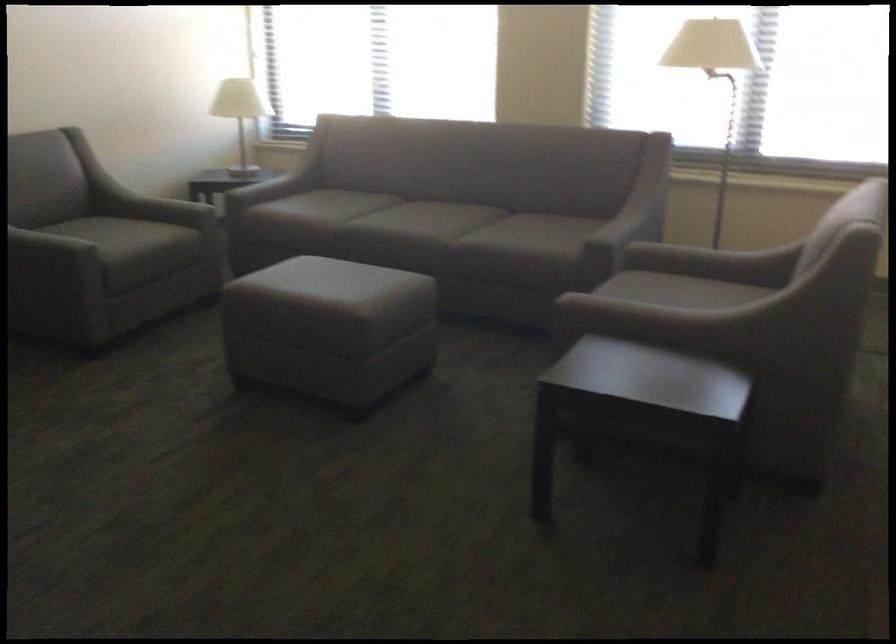
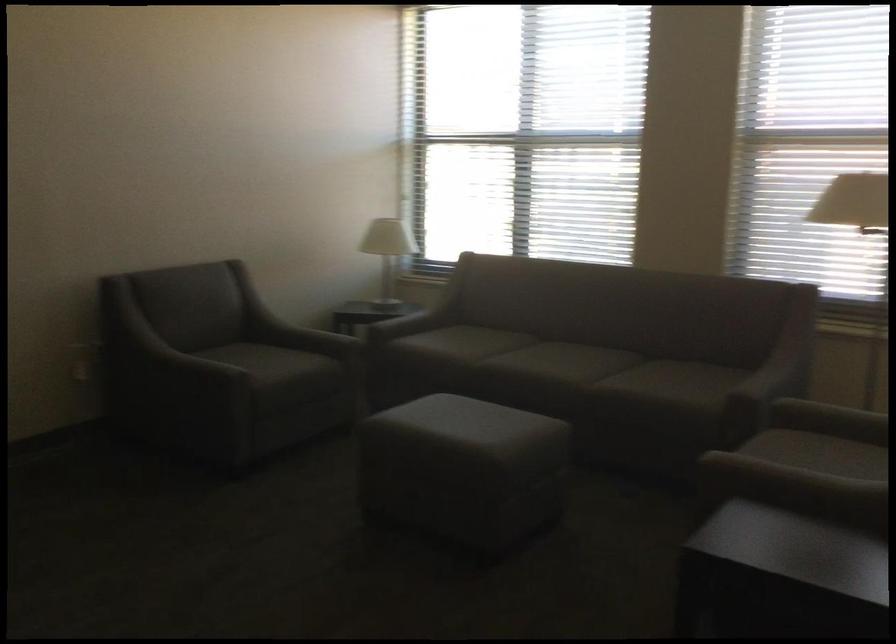
The point at (112, 234) is marked in the first image. Where is the corresponding point in the second image?

(259, 359)